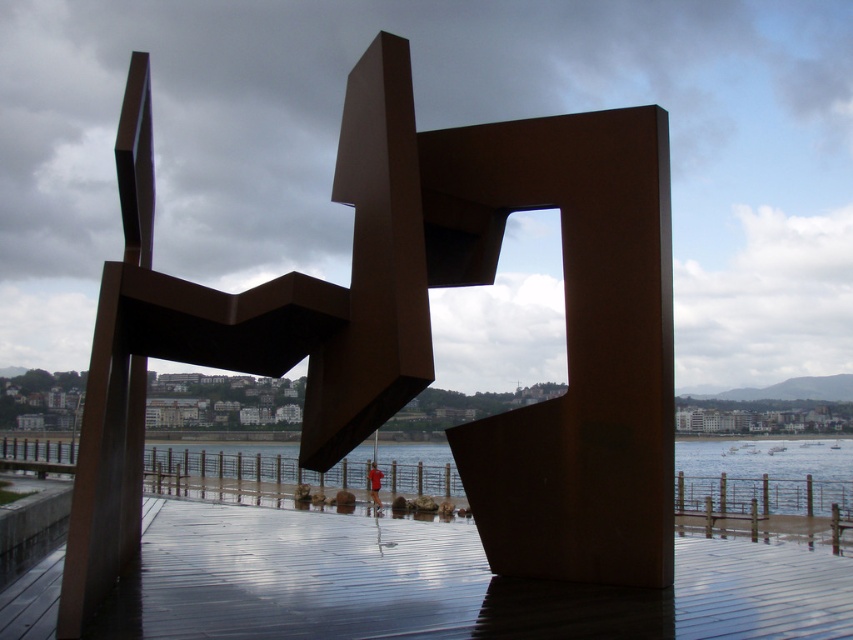
Does shiny wooden dock at center appear on the right side of clear water at lower center?

Correct, you'll find shiny wooden dock at center to the right of clear water at lower center.

Based on the photo, is shiny wooden dock at center in front of clear water at lower center?

That is True.

Does point (495, 612) come behind point (200, 490)?

No.

I want to click on shiny wooden dock at center, so click(x=444, y=584).

Looking at this image, who is more distant from viewer, (558, 422) or (378, 600)?

Point (558, 422)

Who is more forward, (202, 296) or (805, 628)?

Point (805, 628) is more forward.

Where is `rusty metal sculpture at center`? This screenshot has height=640, width=853. rusty metal sculpture at center is located at coordinates (421, 330).

Which is below, rusty metal sculpture at center or clear water at lower center?

Positioned lower is clear water at lower center.

Can you confirm if rusty metal sculpture at center is positioned to the right of clear water at lower center?

No, rusty metal sculpture at center is not to the right of clear water at lower center.

Between point (138, 68) and point (712, 442), which one is positioned behind?

The point (712, 442) is more distant.

The height and width of the screenshot is (640, 853). Identify the location of rusty metal sculpture at center. (421, 330).